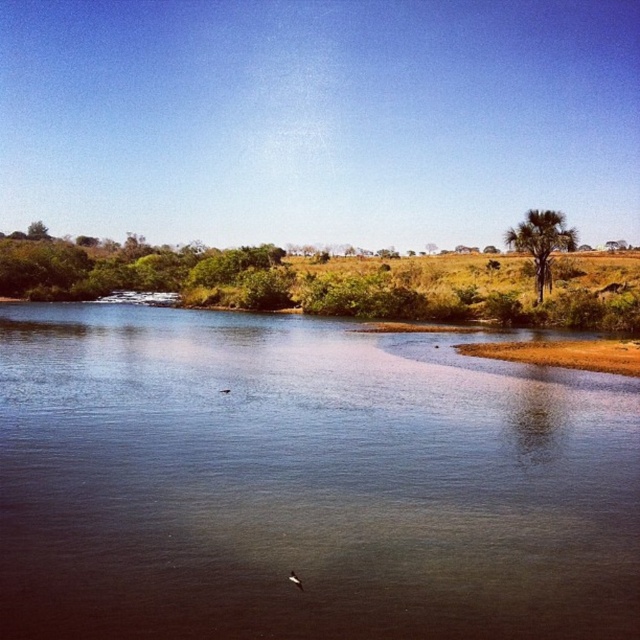
Is blue smooth water at center wider than white feathered bird at lower center?

Correct, the width of blue smooth water at center exceeds that of white feathered bird at lower center.

Who is positioned more to the left, blue smooth water at center or white feathered bird at lower center?

white feathered bird at lower center is more to the left.

You are a GUI agent. You are given a task and a screenshot of the screen. Output one action in this format:
    pyautogui.click(x=<x>, y=<y>)
    Task: Click on the blue smooth water at center
    This screenshot has width=640, height=640.
    Given the screenshot: What is the action you would take?
    pyautogui.click(x=305, y=483)

Identify the location of blue smooth water at center. (305, 483).

From the picture: Is blue smooth water at center to the right of green leafy tree at right from the viewer's perspective?

No, blue smooth water at center is not to the right of green leafy tree at right.

Does blue smooth water at center appear over green leafy tree at right?

No.

Where is `blue smooth water at center`? The width and height of the screenshot is (640, 640). blue smooth water at center is located at coordinates (305, 483).

What do you see at coordinates (540, 241) in the screenshot? This screenshot has height=640, width=640. I see `green leafy tree at right` at bounding box center [540, 241].

Is point (506, 243) less distant than point (300, 586)?

No, (506, 243) is behind (300, 586).

The height and width of the screenshot is (640, 640). Find the location of `green leafy tree at right`. green leafy tree at right is located at coordinates (540, 241).